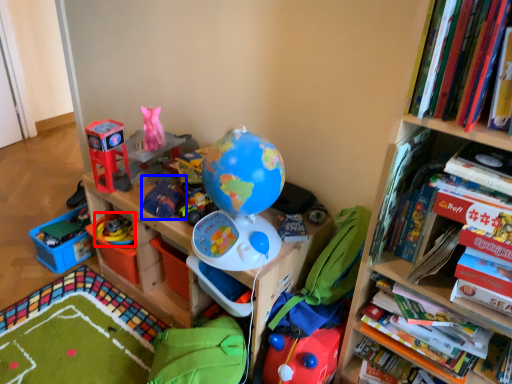
Question: Which point is closer to the camera, toy (highlighted by a red box) or toy (highlighted by a blue box)?

Choices:
 (A) toy
 (B) toy

Answer: (B)